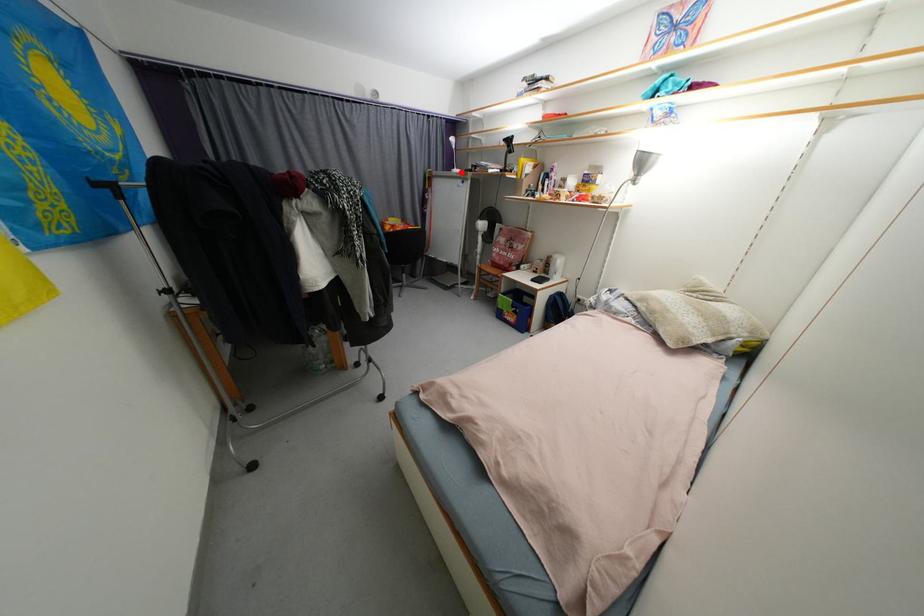
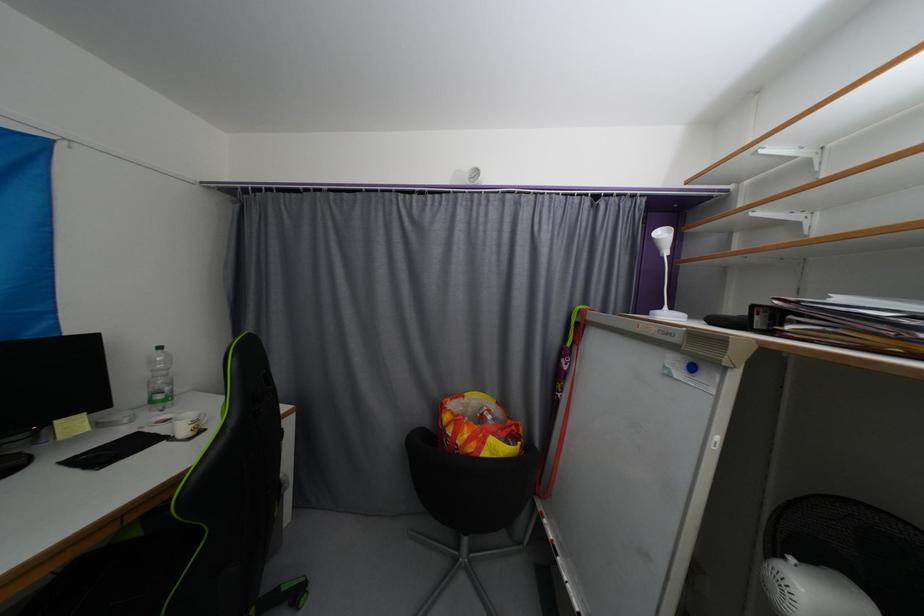
Question: I am providing you with two images of the same scene from different viewpoints. Given a red point in image1, look at the same physical point in image2. Is it:

Choices:
 (A) Closer to the viewpoint
 (B) Farther from the viewpoint

Answer: (B)